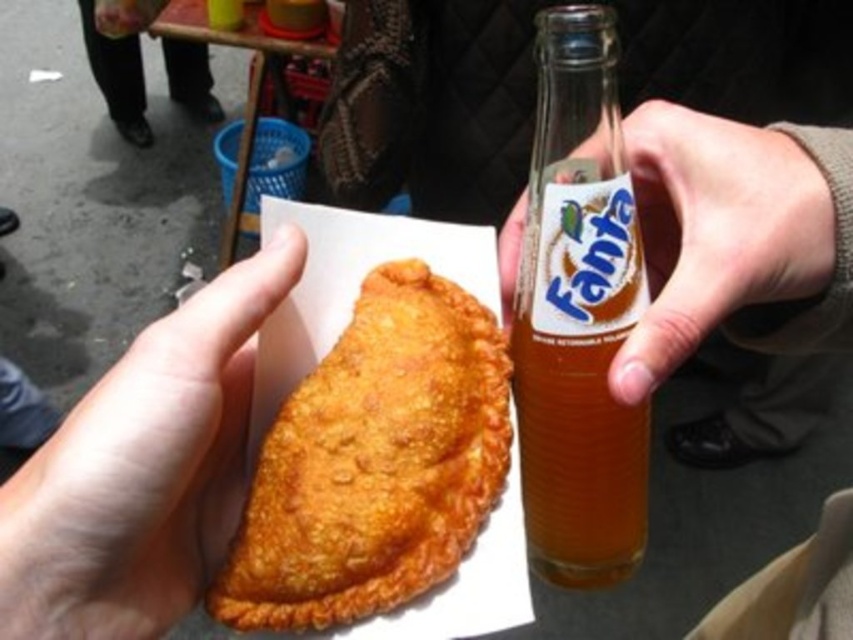
You are at a food stall and see the golden fried pastry at center and the translucent glass bottle at center. If you want to grab the pastry without moving the bottle, which direction should you move your hand?

Answer: The golden fried pastry at center is positioned under the translucent glass bottle at center, so you should move your hand upward to grab the pastry without disturbing the bottle.

You are at a food stall and want to know if the golden fried pastry at center can fit into the translucent glass bottle at center. Based on their sizes, can it fit vertically?

The golden fried pastry at center has a lesser height compared to the translucent glass bottle at center, so it might fit vertically if the bottle is tall enough. However, the pastry is triangular and might not fit through the narrow opening of the bottle.

You are a food critic standing in front of a street vendor. You see the golden fried pastry at center and the brown leather pants at lower center. Which item is nearer to you?

The golden fried pastry at center is closer to the viewer than the brown leather pants at lower center.